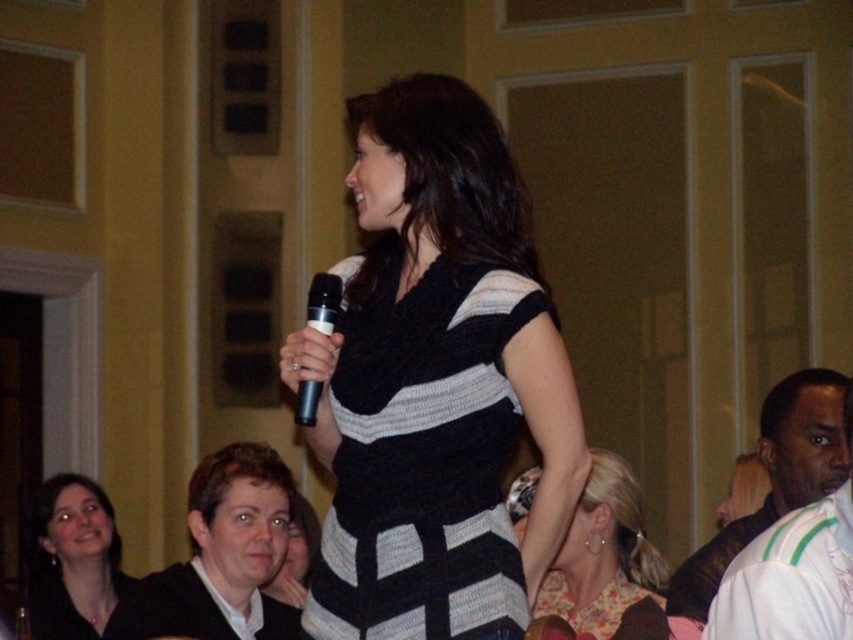
Question: Which point appears farthest from the camera in this image?

Choices:
 (A) (368, 332)
 (B) (299, 403)
 (C) (215, 474)
 (D) (627, 509)

Answer: (C)

Question: Can you confirm if black knitted dress at center is smaller than white cotton shirt at right?

Choices:
 (A) no
 (B) yes

Answer: (B)

Question: Estimate the real-world distances between objects in this image. Which object is farther from the white cotton shirt at right?

Choices:
 (A) floral fabric dress at center
 (B) matte black sweater at lower left
 (C) dark brown hair at lower left
 (D) black plastic microphone at center

Answer: (B)

Question: Is black knitted dress at center smaller than matte black sweater at lower left?

Choices:
 (A) no
 (B) yes

Answer: (B)

Question: Which object is farther from the camera taking this photo?

Choices:
 (A) matte black sweater at lower left
 (B) black knitted dress at center
 (C) dark brown hair at lower left

Answer: (A)

Question: From the image, what is the correct spatial relationship of dark brown hair at lower left in relation to floral fabric dress at center?

Choices:
 (A) above
 (B) below

Answer: (B)